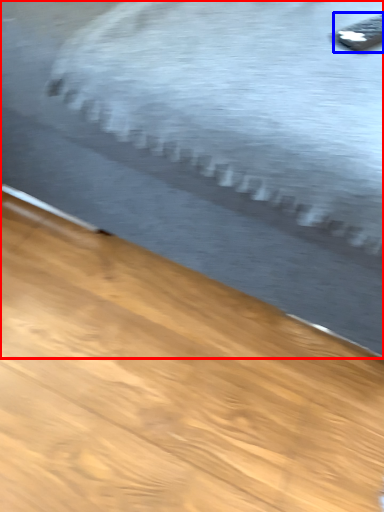
Question: Which point is further to the camera, bed (highlighted by a red box) or remote (highlighted by a blue box)?

Choices:
 (A) bed
 (B) remote

Answer: (B)